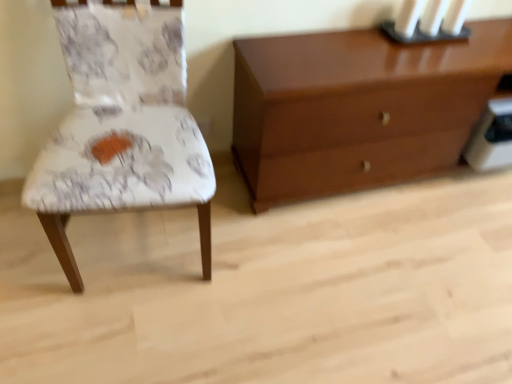
Where is `vacant space to the left of black matte candle holder at upper right`? This screenshot has width=512, height=384. vacant space to the left of black matte candle holder at upper right is located at coordinates (357, 39).